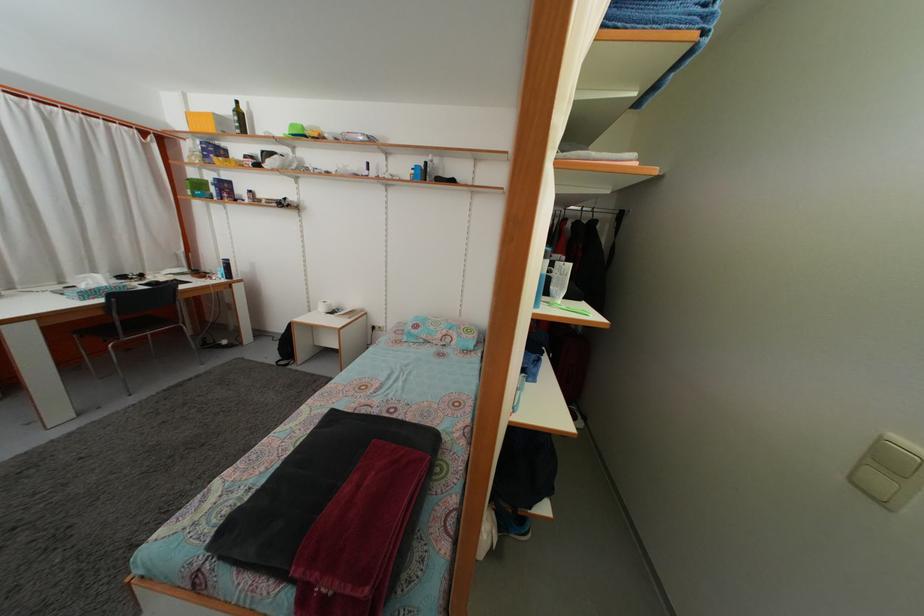
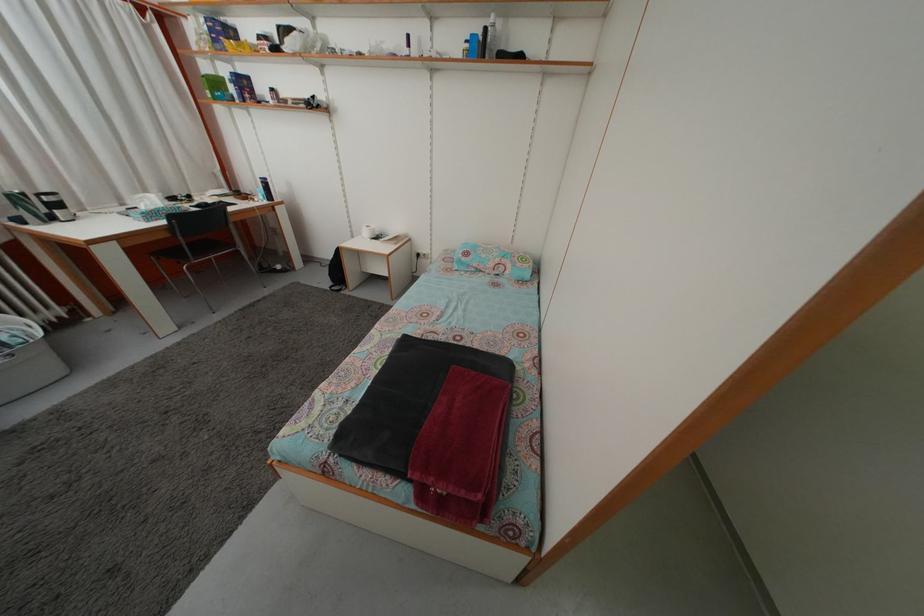
Question: Based on the continuous images, in which direction is the camera rotating? Reply with the corresponding letter.

Choices:
 (A) Left
 (B) Right
 (C) Up
 (D) Down

Answer: (D)